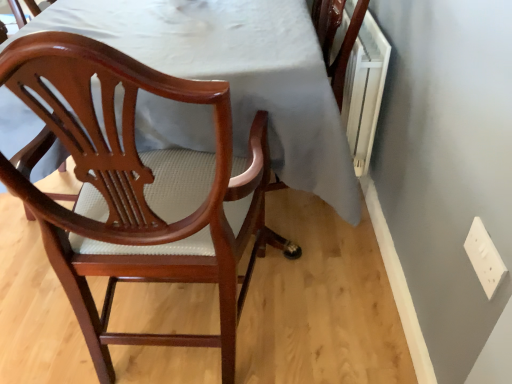
Locate an element on the screen. The image size is (512, 384). white plastic electric outlet at lower right is located at coordinates (484, 257).

This screenshot has width=512, height=384. Describe the element at coordinates (484, 257) in the screenshot. I see `white plastic electric outlet at lower right` at that location.

What is the approximate height of mahogany wood chair at left?

mahogany wood chair at left is 98.14 centimeters in height.

Describe the element at coordinates (137, 189) in the screenshot. This screenshot has height=384, width=512. I see `mahogany wood chair at left` at that location.

The height and width of the screenshot is (384, 512). Identify the location of mahogany wood chair at left. (137, 189).

You are a GUI agent. You are given a task and a screenshot of the screen. Output one action in this format:
    pyautogui.click(x=<x>, y=<y>)
    Task: Click on the white plastic electric outlet at lower right
    This screenshot has height=384, width=512.
    Given the screenshot: What is the action you would take?
    pyautogui.click(x=484, y=257)

Visually, is mahogany wood chair at left positioned to the left or to the right of white plastic electric outlet at lower right?

In the image, mahogany wood chair at left appears on the left side of white plastic electric outlet at lower right.

Does mahogany wood chair at left come behind white plastic electric outlet at lower right?

No, mahogany wood chair at left is closer to the viewer.

Considering the positions of points (222, 347) and (490, 277), is point (222, 347) closer to camera compared to point (490, 277)?

No, it is not.

From the image's perspective, which is above, mahogany wood chair at left or white plastic electric outlet at lower right?

mahogany wood chair at left appears higher in the image.

From a real-world perspective, which object rests below the other?

mahogany wood chair at left, from a real-world perspective.

In terms of width, does mahogany wood chair at left look wider or thinner when compared to white plastic electric outlet at lower right?

Considering their sizes, mahogany wood chair at left looks broader than white plastic electric outlet at lower right.

Does mahogany wood chair at left have a lesser height compared to white plastic electric outlet at lower right?

Incorrect, the height of mahogany wood chair at left does not fall short of that of white plastic electric outlet at lower right.

Who is bigger, mahogany wood chair at left or white plastic electric outlet at lower right?

mahogany wood chair at left.

Is mahogany wood chair at left inside the boundaries of white plastic electric outlet at lower right, or outside?

mahogany wood chair at left cannot be found inside white plastic electric outlet at lower right.

Would you consider mahogany wood chair at left to be distant from white plastic electric outlet at lower right?

No, mahogany wood chair at left is not far away from white plastic electric outlet at lower right.

Is mahogany wood chair at left facing away from white plastic electric outlet at lower right?

No, mahogany wood chair at left's orientation is not away from white plastic electric outlet at lower right.

I want to click on chair that appears in front of the white plastic electric outlet at lower right, so click(137, 189).

Which is more to the right, white plastic electric outlet at lower right or mahogany wood chair at left?

Positioned to the right is white plastic electric outlet at lower right.

Which is in front, white plastic electric outlet at lower right or mahogany wood chair at left?

Positioned in front is mahogany wood chair at left.

Between point (480, 218) and point (102, 131), which one is positioned behind?

Point (480, 218)

From the image's perspective, between white plastic electric outlet at lower right and mahogany wood chair at left, who is located below?

white plastic electric outlet at lower right, from the image's perspective.

From a real-world perspective, is white plastic electric outlet at lower right above or below mahogany wood chair at left?

white plastic electric outlet at lower right is situated higher than mahogany wood chair at left in the real world.

Considering the relative sizes of white plastic electric outlet at lower right and mahogany wood chair at left in the image provided, is white plastic electric outlet at lower right thinner than mahogany wood chair at left?

Correct, the width of white plastic electric outlet at lower right is less than that of mahogany wood chair at left.

Considering the sizes of objects white plastic electric outlet at lower right and mahogany wood chair at left in the image provided, who is shorter, white plastic electric outlet at lower right or mahogany wood chair at left?

white plastic electric outlet at lower right.

Can you confirm if white plastic electric outlet at lower right is smaller than mahogany wood chair at left?

Yes, white plastic electric outlet at lower right is smaller than mahogany wood chair at left.

Can mahogany wood chair at left be found inside white plastic electric outlet at lower right?

No, mahogany wood chair at left is not a part of white plastic electric outlet at lower right.

Is white plastic electric outlet at lower right with mahogany wood chair at left?

No, white plastic electric outlet at lower right is not with mahogany wood chair at left.

Is white plastic electric outlet at lower right aimed at mahogany wood chair at left?

Yes, white plastic electric outlet at lower right is facing mahogany wood chair at left.

This screenshot has width=512, height=384. There is a mahogany wood chair at left. In order to click on electric outlet above it (from a real-world perspective) in this screenshot , I will do click(484, 257).

This screenshot has height=384, width=512. In order to click on chair below the white plastic electric outlet at lower right (from a real-world perspective) in this screenshot , I will do `click(137, 189)`.

Find the location of a particular element. chair that appears in front of the white plastic electric outlet at lower right is located at coordinates (137, 189).